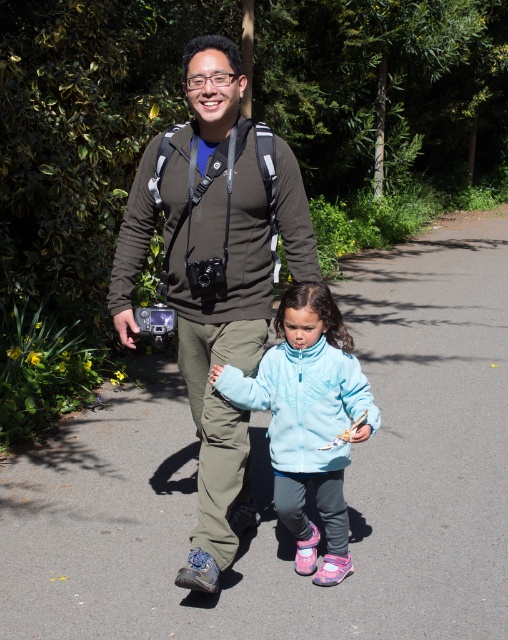
You are a hiker who needs to determine which jacket is more suitable for a sudden rain shower based on their sizes. Given that the matte green jacket at center and the light blue fleece jacket at center are both in your backpack, which one would you choose?

The matte green jacket at center is larger in size than the light blue fleece jacket at center, so it would provide better coverage against rain showers.

You are standing at the point marked as point (271,481) in the image. What type of surface are you currently standing on?

You are standing on gray asphalt pavement at center.